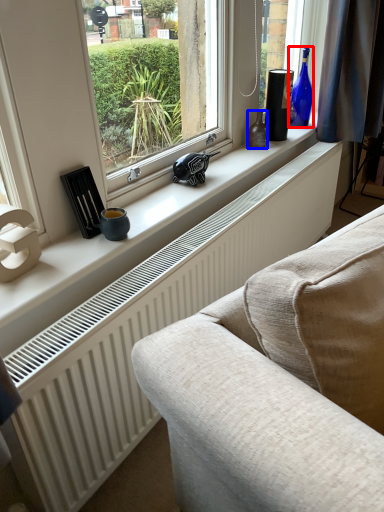
Question: Which object is closer to the camera taking this photo, bottle (highlighted by a red box) or bottle (highlighted by a blue box)?

Choices:
 (A) bottle
 (B) bottle

Answer: (B)